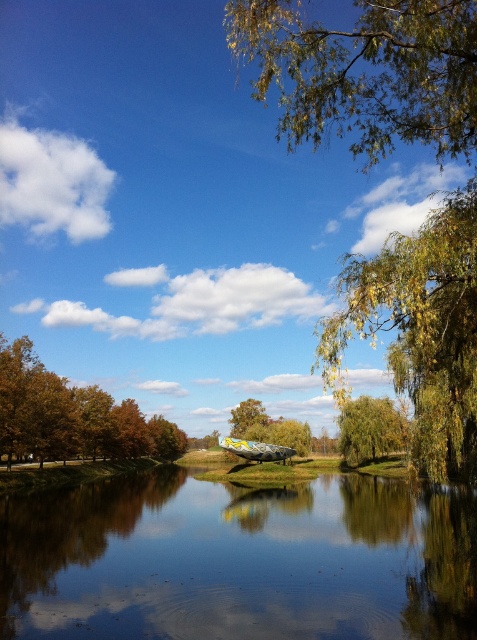
You are standing in the landscape scene and want to take a photo of both the green leafy branches at upper center and the brown matte tree at lower left. Which object should you focus on first to ensure both are in clear view?

You should focus on the green leafy branches at upper center first since it is closer to the viewer than the brown matte tree at lower left. By focusing on the closer object, both will be in clear view due to the overlapping depth of field.

You are standing at the edge of the water and want to place a small boat exactly 12 meters away from where you are standing. Can you place it on the smooth reflective water at center?

The smooth reflective water at center is 13.01 meters away from the viewer. Since 13.01 meters is greater than 12 meters, the boat can be placed 12 meters away within the smooth reflective water at center.